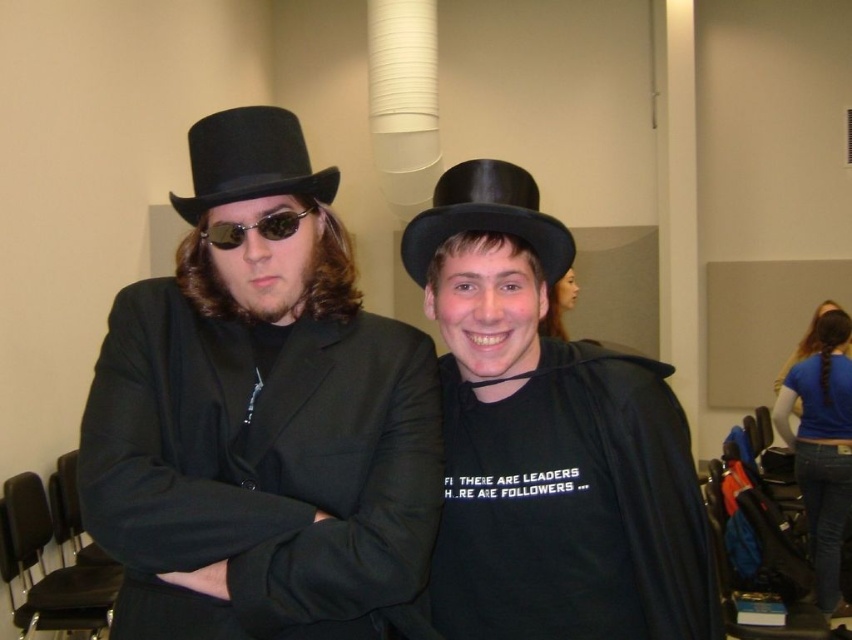
You are a photographer setting up a shoot in this indoor scene. You need to position a 10 inch wide decorative item between the black felt fedora at center and the matte black sunglasses at center. Can you fit it there?

The distance between the black felt fedora at center and the matte black sunglasses at center is 8.94 inches, which is less than the 10 inch width of the decorative item. Therefore, the item cannot fit between them.

You are standing in the room and want to touch both points. Which point should you reach for first, point (242, 292) or point (468, 432)?

Point (242, 292) is closer to the viewer than point (468, 432), so you should reach for point (242, 292) first.